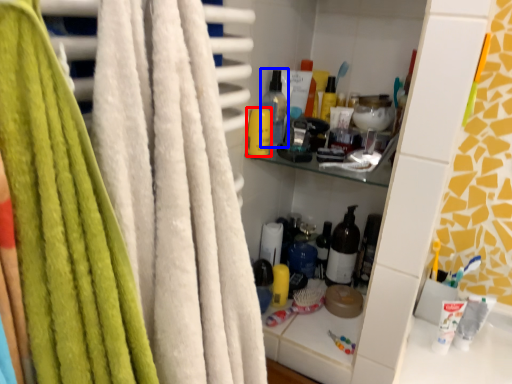
Question: Which object is closer to the camera taking this photo, toiletry (highlighted by a red box) or bottle (highlighted by a blue box)?

Choices:
 (A) toiletry
 (B) bottle

Answer: (A)